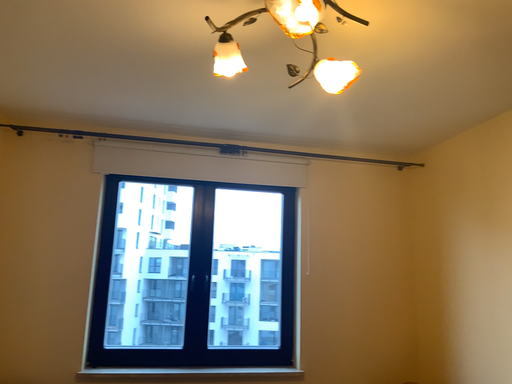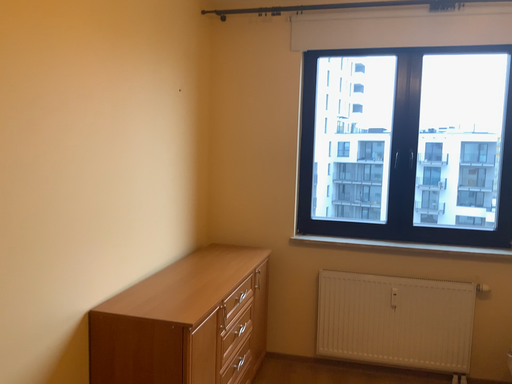
Question: How did the camera likely rotate when shooting the video?

Choices:
 (A) rotated downward
 (B) rotated upward

Answer: (A)